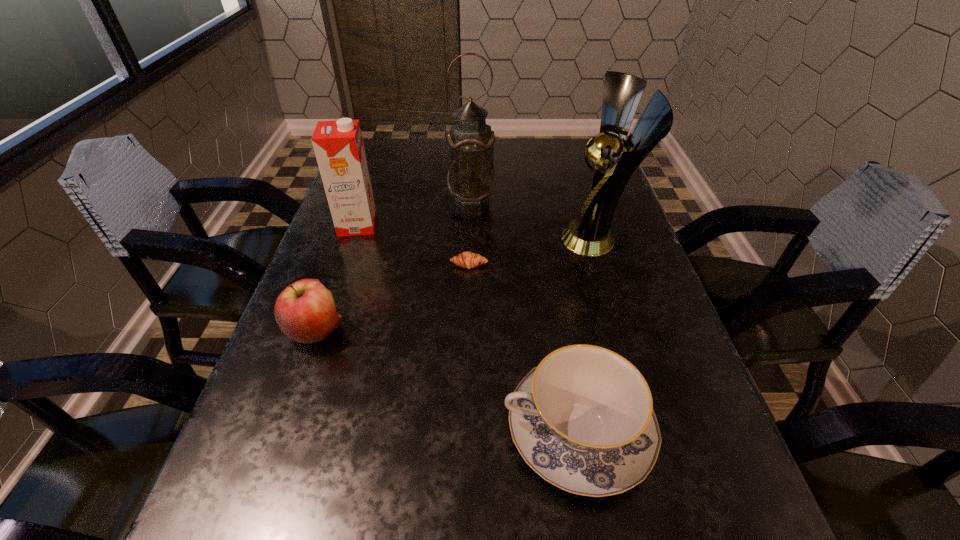
This screenshot has width=960, height=540. In order to click on vacant region between the nearest object and the fifth farthest object in this screenshot , I will do `click(446, 381)`.

Where is `free space between the apple and the award`? The image size is (960, 540). free space between the apple and the award is located at coordinates (457, 285).

Identify the location of vacant space in between the nearest object and the pastry. (523, 348).

Locate an element on the screen. The height and width of the screenshot is (540, 960). object that is the third nearest to the fourth shortest object is located at coordinates (305, 311).

Identify which object is located as the third nearest to the oil lamp. Please provide its 2D coordinates. Your answer should be formatted as a tuple, i.e. [(x, y)], where the tuple contains the x and y coordinates of a point satisfying the conditions above.

[(468, 260)]

Find the location of a particular element. The image size is (960, 540). vacant space that satisfies the following two spatial constraints: 1. with the handle on the side of the chinaware; 2. on the front-facing side of the shortest object is located at coordinates (549, 265).

At what (x,y) coordinates should I click in order to perform the action: click on free spot that satisfies the following two spatial constraints: 1. at the front of the award, where the globe is visible; 2. on the front-facing side of the pastry. Please return your answer as a coordinate pair (x, y). Looking at the image, I should click on (606, 265).

You are a GUI agent. You are given a task and a screenshot of the screen. Output one action in this format:
    pyautogui.click(x=<x>, y=<y>)
    Task: Click on the free spot that satisfies the following two spatial constraints: 1. on the back side of the oil lamp; 2. on the right side of the third tallest object
    
    Given the screenshot: What is the action you would take?
    pyautogui.click(x=366, y=200)

This screenshot has height=540, width=960. I want to click on free spot that satisfies the following two spatial constraints: 1. on the back side of the oil lamp; 2. on the left side of the carton, so click(366, 200).

Identify the location of free point that satisfies the following two spatial constraints: 1. at the front of the award, where the globe is visible; 2. on the front side of the apple. (627, 330).